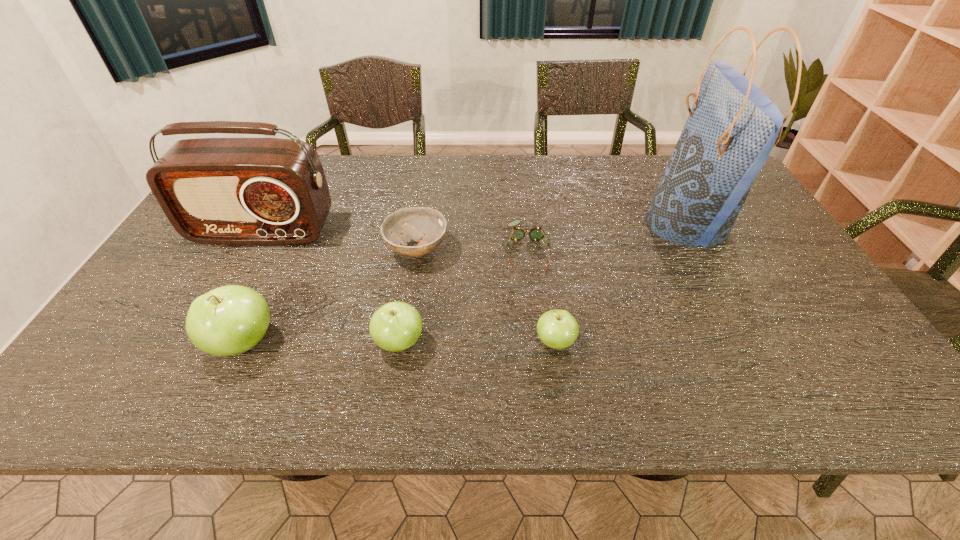
Find the location of a particular element. Image resolution: width=960 pixels, height=540 pixels. vacant space that is in between the tallest object and the sixth shortest object is located at coordinates (475, 228).

At what (x,y) coordinates should I click in order to perform the action: click on free spot between the second shortest apple and the shortest object. Please return your answer as a coordinate pair (x, y). The width and height of the screenshot is (960, 540). Looking at the image, I should click on (464, 296).

Locate an element on the screen. The width and height of the screenshot is (960, 540). free spot between the shortest object and the second apple from left to right is located at coordinates (464, 296).

Identify which object is located as the second nearest to the shortest apple. Please provide its 2D coordinates. Your answer should be formatted as a tuple, i.e. [(x, y)], where the tuple contains the x and y coordinates of a point satisfying the conditions above.

[(396, 326)]

Identify which object is located as the second nearest to the second shortest object. Please provide its 2D coordinates. Your answer should be formatted as a tuple, i.e. [(x, y)], where the tuple contains the x and y coordinates of a point satisfying the conditions above.

[(227, 191)]

The width and height of the screenshot is (960, 540). I want to click on the closest apple relative to the leftmost apple, so click(x=396, y=326).

Select which apple appears as the second closest to the rightmost apple. Please provide its 2D coordinates. Your answer should be formatted as a tuple, i.e. [(x, y)], where the tuple contains the x and y coordinates of a point satisfying the conditions above.

[(230, 320)]

Where is `blank area in the image that satisfies the following two spatial constraints: 1. on the front-facing side of the rightmost apple; 2. on the right side of the spectacles`? This screenshot has height=540, width=960. blank area in the image that satisfies the following two spatial constraints: 1. on the front-facing side of the rightmost apple; 2. on the right side of the spectacles is located at coordinates (538, 342).

This screenshot has height=540, width=960. I want to click on free space that satisfies the following two spatial constraints: 1. on the front panel of the radio receiver; 2. on the left side of the second shortest apple, so click(x=202, y=342).